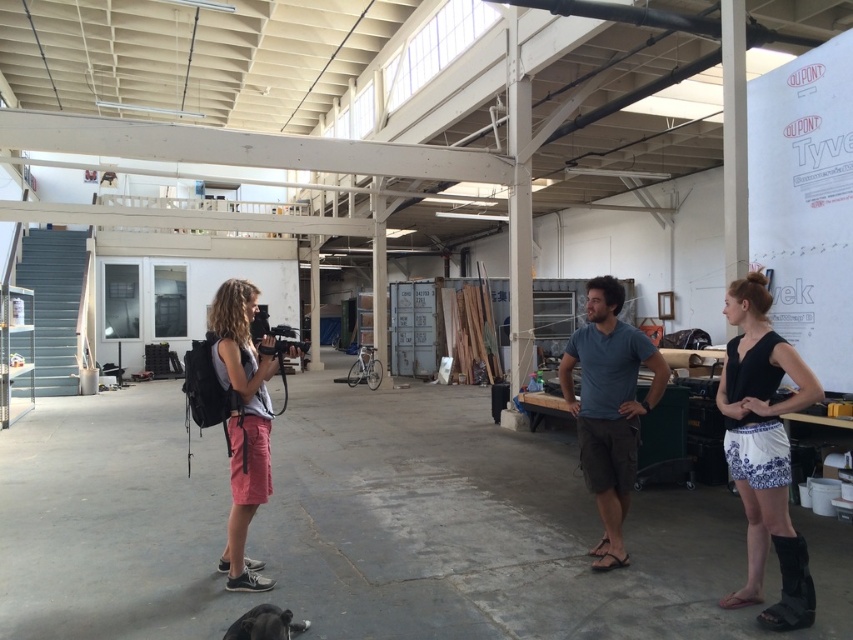
How far apart are blue cotton shirt at center and matte black camera at left?

7.35 feet

Is blue cotton shirt at center positioned in front of matte black camera at left?

No, it is not.

Identify the location of blue cotton shirt at center. This screenshot has height=640, width=853. (608, 406).

Which is in front, point (769, 412) or point (650, 394)?

Point (769, 412) is more forward.

The width and height of the screenshot is (853, 640). Find the location of `black matte shorts at right`. black matte shorts at right is located at coordinates (764, 451).

Who is more forward, [752,337] or [262,477]?

Point [752,337] is more forward.

Is black matte shorts at right positioned behind matte black camera at left?

That is False.

Which is in front, point (786, 536) or point (234, 289)?

Point (786, 536) is in front.

What are the coordinates of `black matte shorts at right` in the screenshot? It's located at click(764, 451).